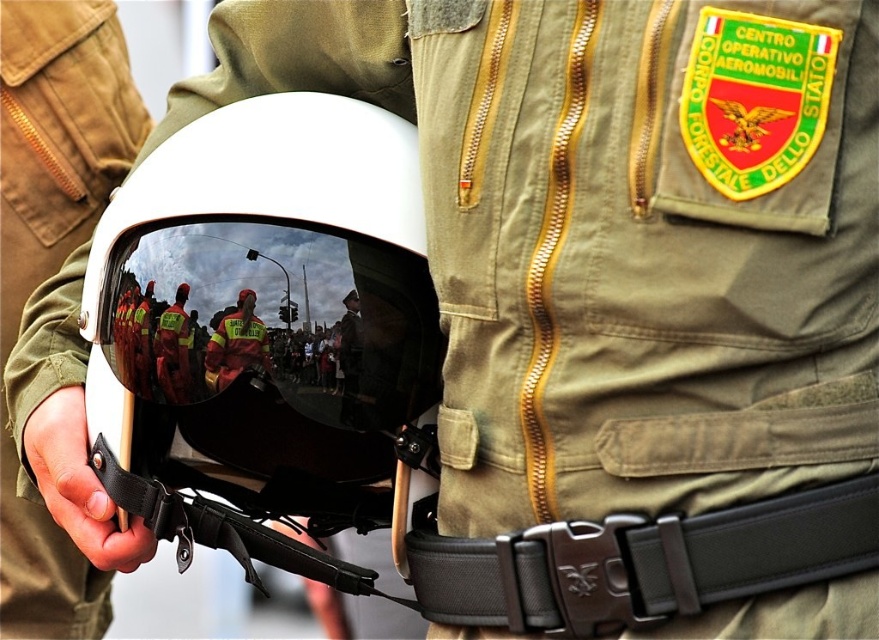
Question: Which point is farther from the camera taking this photo?

Choices:
 (A) (166, 401)
 (B) (230, 317)
 (C) (405, 236)

Answer: (A)

Question: Where is shiny reflective goggles at center located in relation to reflective plastic helmet at center in the image?

Choices:
 (A) above
 (B) below

Answer: (A)

Question: Among these objects, which one is farthest from the camera?

Choices:
 (A) reflective plastic helmet at center
 (B) shiny reflective goggles at center

Answer: (A)

Question: Does shiny reflective goggles at center have a larger size compared to reflective plastic helmet at center?

Choices:
 (A) yes
 (B) no

Answer: (A)

Question: Among these objects, which one is nearest to the camera?

Choices:
 (A) reflective plastic helmet at center
 (B) shiny reflective goggles at center

Answer: (B)

Question: Is the position of reflective plastic helmet at center more distant than that of reflective yellow vest at center?

Choices:
 (A) yes
 (B) no

Answer: (A)